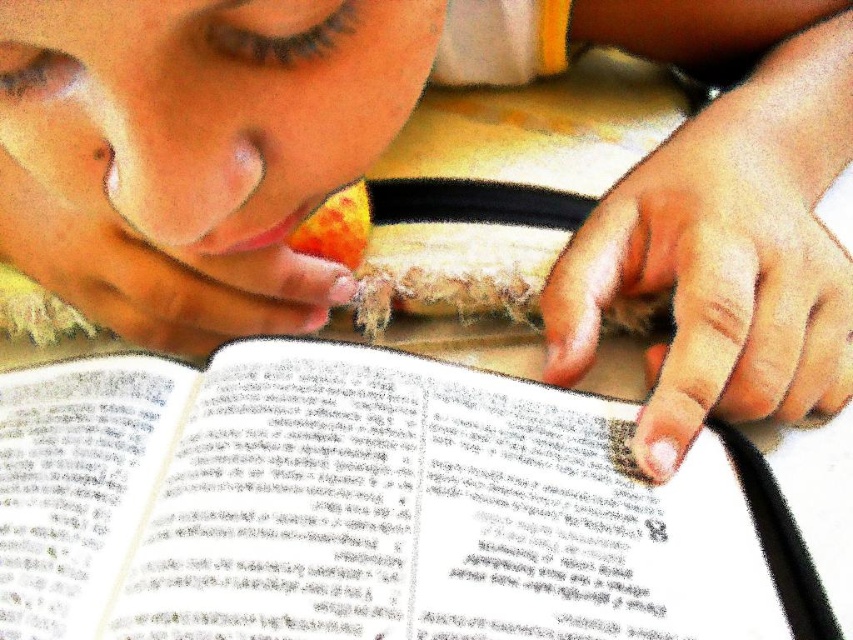
Is white paper book at center to the left of smooth skin hand at lower right from the viewer's perspective?

Yes, white paper book at center is to the left of smooth skin hand at lower right.

Is point (695, 628) positioned behind point (773, 396)?

That is False.

Locate an element on the screen. The width and height of the screenshot is (853, 640). white paper book at center is located at coordinates (372, 508).

In the scene shown: Does white paper book at center appear on the right side of smooth skin hand at center?

Correct, you'll find white paper book at center to the right of smooth skin hand at center.

In the scene shown: Who is more distant from viewer, (730,577) or (267,289)?

Point (267,289)

Locate an element on the screen. white paper book at center is located at coordinates (372, 508).

Which is more to the left, smooth skin hand at lower right or smooth skin hand at center?

smooth skin hand at center is more to the left.

You are a GUI agent. You are given a task and a screenshot of the screen. Output one action in this format:
    pyautogui.click(x=<x>, y=<y>)
    Task: Click on the smooth skin hand at lower right
    Image resolution: width=853 pixels, height=640 pixels.
    Given the screenshot: What is the action you would take?
    pyautogui.click(x=717, y=273)